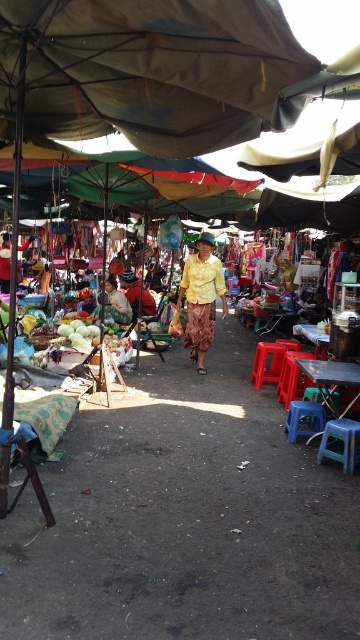
Which is below, yellow printed fabric at center or blue plastic stool at lower right?

Positioned lower is blue plastic stool at lower right.

Between point (182, 275) and point (312, 413), which one is positioned in front?

Positioned in front is point (312, 413).

Is point (205, 275) positioned in front of point (299, 413)?

No, (205, 275) is further to viewer.

Locate an element on the screen. This screenshot has height=640, width=360. yellow printed fabric at center is located at coordinates (201, 298).

Does point (354, 422) come farther from viewer compared to point (290, 420)?

No.

Between yellow plastic stool at lower right and blue plastic stool at lower right, which one has more height?

Standing taller between the two is yellow plastic stool at lower right.

Locate an element on the screen. This screenshot has height=640, width=360. yellow plastic stool at lower right is located at coordinates (340, 442).

Can you confirm if brown canvas canopy at upper center is positioned to the left of blue plastic stool at lower right?

Yes, brown canvas canopy at upper center is to the left of blue plastic stool at lower right.

From the picture: Between brown canvas canopy at upper center and blue plastic stool at lower right, which one appears on the right side from the viewer's perspective?

blue plastic stool at lower right is more to the right.

The width and height of the screenshot is (360, 640). What do you see at coordinates (153, 70) in the screenshot?
I see `brown canvas canopy at upper center` at bounding box center [153, 70].

Image resolution: width=360 pixels, height=640 pixels. In order to click on brown canvas canopy at upper center in this screenshot , I will do `click(153, 70)`.